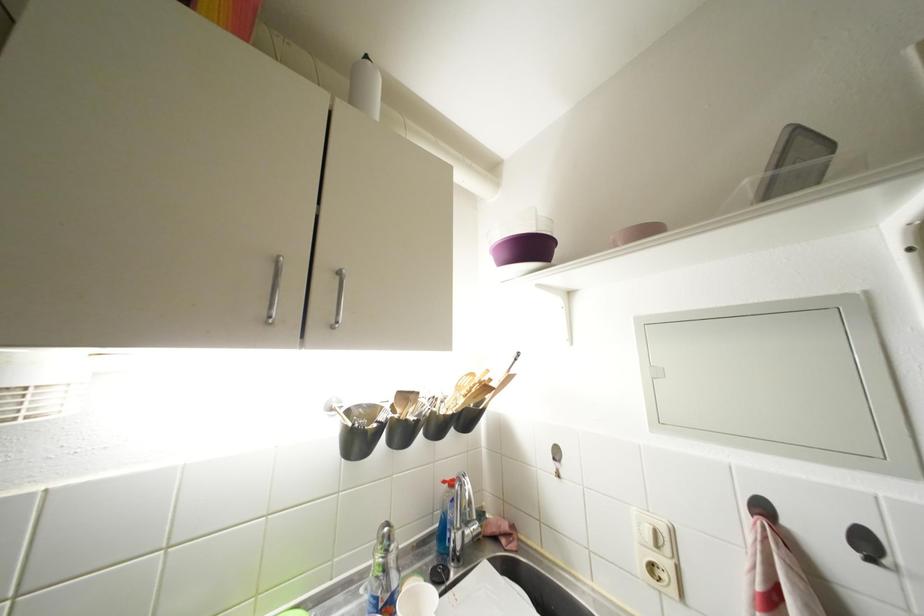
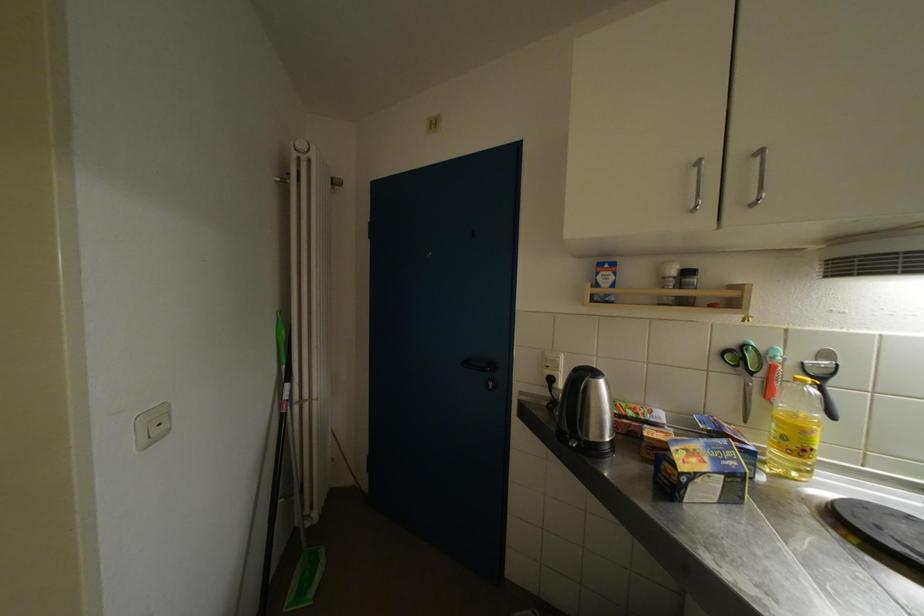
Question: How did the camera likely rotate?

Choices:
 (A) Left
 (B) Right
 (C) Up
 (D) Down

Answer: (A)